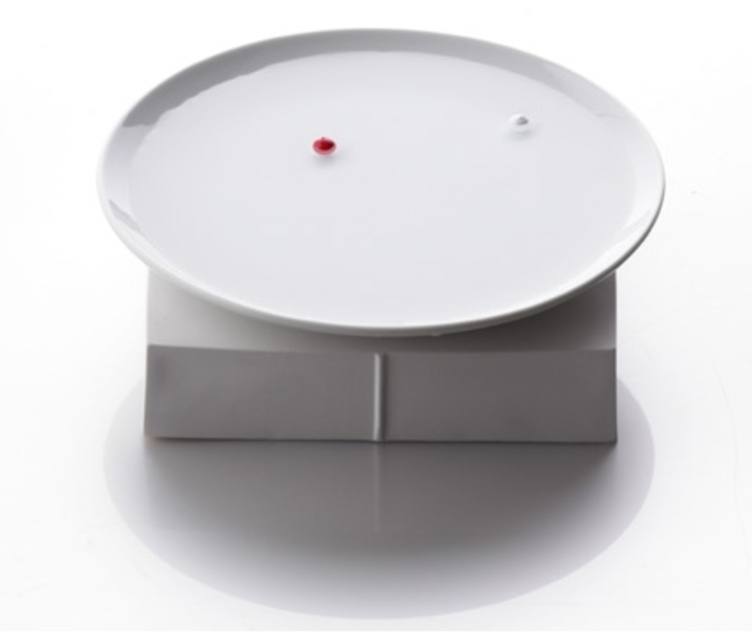
You are looking at the smart home sensor from the front. There are two points marked on the device. The first point is at coordinates point (402, 33) and the second is at point (208, 426). Which point is closer to you?

Point (208, 426) is closer to you because point (402, 33) is behind it.

You are a technician inspecting a smart home sensor. You notice a point at coordinates (381, 180) on the device. What does this point indicate?

The point at coordinates (381, 180) marks the white glossy lid at center, which is likely the location of a status indicator or button on the device.